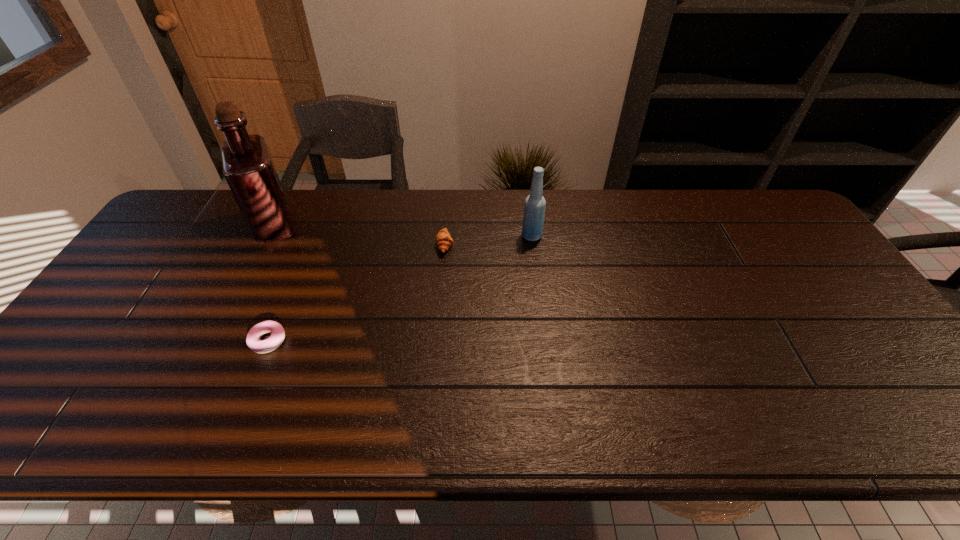
You are a GUI agent. You are given a task and a screenshot of the screen. Output one action in this format:
    pyautogui.click(x=<x>, y=<y>)
    Task: Click on the free space located 0.210m on the back of the shortest object
    
    Given the screenshot: What is the action you would take?
    pyautogui.click(x=298, y=268)

The image size is (960, 540). I want to click on liquor that is positioned at the far edge, so click(x=248, y=168).

Identify the location of bottle that is at the far edge. This screenshot has height=540, width=960. (534, 210).

At what (x,y) coordinates should I click in order to perform the action: click on pastry that is at the far edge. Please return your answer as a coordinate pair (x, y). Looking at the image, I should click on (443, 239).

Where is `vacant space at the far edge of the desktop`? This screenshot has width=960, height=540. vacant space at the far edge of the desktop is located at coordinates (327, 189).

This screenshot has width=960, height=540. I want to click on blank space at the near edge, so [710, 419].

At what (x,y) coordinates should I click in order to perform the action: click on blank space at the right edge. Please return your answer as a coordinate pair (x, y). The width and height of the screenshot is (960, 540). Looking at the image, I should click on (836, 331).

This screenshot has height=540, width=960. What are the coordinates of `vacant space at the far left corner of the desktop` in the screenshot? It's located at (187, 194).

Where is `free point between the nearest object and the third shortest object`? The height and width of the screenshot is (540, 960). free point between the nearest object and the third shortest object is located at coordinates (400, 288).

At what (x,y) coordinates should I click in order to perform the action: click on blank region between the liquor and the right pastry. Please return your answer as a coordinate pair (x, y). The image size is (960, 540). Looking at the image, I should click on (360, 235).